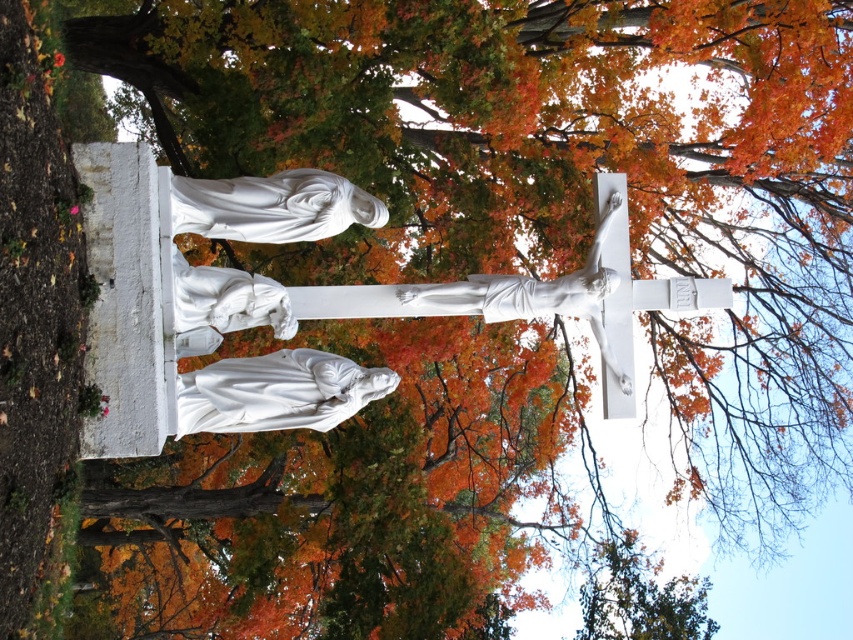
You are an art student analyzing the composition of the religious sculpture. You notice two main elements, the white marble statue at lower center and the white marble crucifix at upper center. Which of these two elements takes up more visual space in the artwork?

The white marble crucifix at upper center takes up more visual space than the white marble statue at lower center.